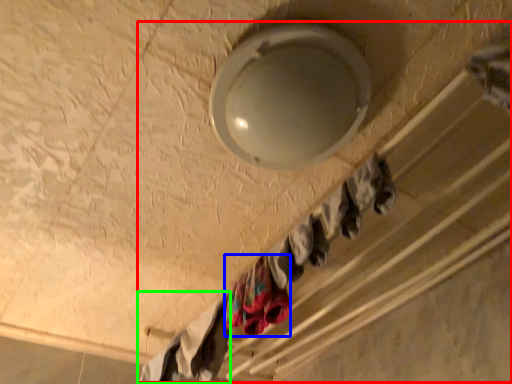
Question: Which object is the closest to the closet (highlighted by a red box)? Choose among these: clothing (highlighted by a blue box) or clothing (highlighted by a green box).

Choices:
 (A) clothing
 (B) clothing

Answer: (B)